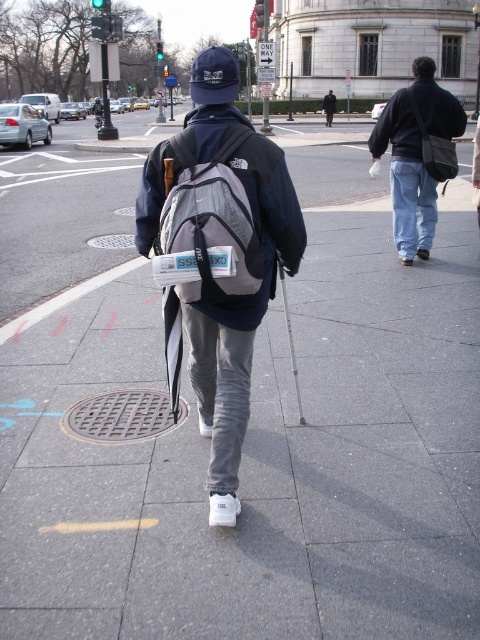
Can you confirm if gray mesh backpack at center is bigger than denim jacket at center?

Incorrect, gray mesh backpack at center is not larger than denim jacket at center.

Is gray mesh backpack at center shorter than denim jacket at center?

Yes, gray mesh backpack at center is shorter than denim jacket at center.

What are the coordinates of `gray mesh backpack at center` in the screenshot? It's located at (208, 218).

Can you confirm if gray mesh backpack at center is positioned above dark blue fabric jacket at center?

Incorrect, gray mesh backpack at center is not positioned above dark blue fabric jacket at center.

Between gray mesh backpack at center and dark blue fabric jacket at center, which one appears on the left side from the viewer's perspective?

A: From the viewer's perspective, gray mesh backpack at center appears more on the left side.

Describe the element at coordinates (208, 218) in the screenshot. This screenshot has height=640, width=480. I see `gray mesh backpack at center` at that location.

You are a GUI agent. You are given a task and a screenshot of the screen. Output one action in this format:
    pyautogui.click(x=<x>, y=<y>)
    Task: Click on the gray mesh backpack at center
    This screenshot has width=480, height=640.
    Given the screenshot: What is the action you would take?
    pyautogui.click(x=208, y=218)

How far apart are denim jacket at center and dark blue fabric jacket at center?

They are 28.37 meters apart.

Can you confirm if denim jacket at center is thinner than dark blue fabric jacket at center?

Yes, denim jacket at center is thinner than dark blue fabric jacket at center.

Which is behind, point (407, 186) or point (328, 104)?

The point (328, 104) is behind.

Identify the location of denim jacket at center. (418, 156).